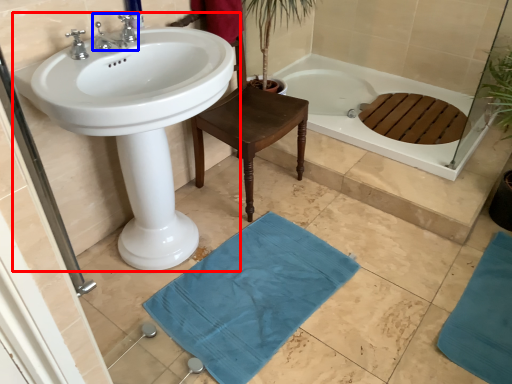
Question: Which point is closer to the camera, sink (highlighted by a red box) or tap (highlighted by a blue box)?

Choices:
 (A) sink
 (B) tap

Answer: (A)